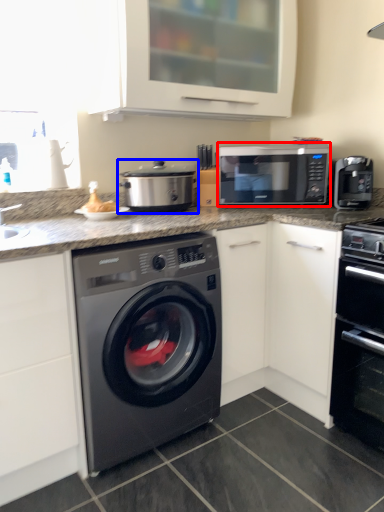
Question: Which point is closer to the camera, microwave oven (highlighted by a red box) or appliance (highlighted by a blue box)?

Choices:
 (A) microwave oven
 (B) appliance

Answer: (B)